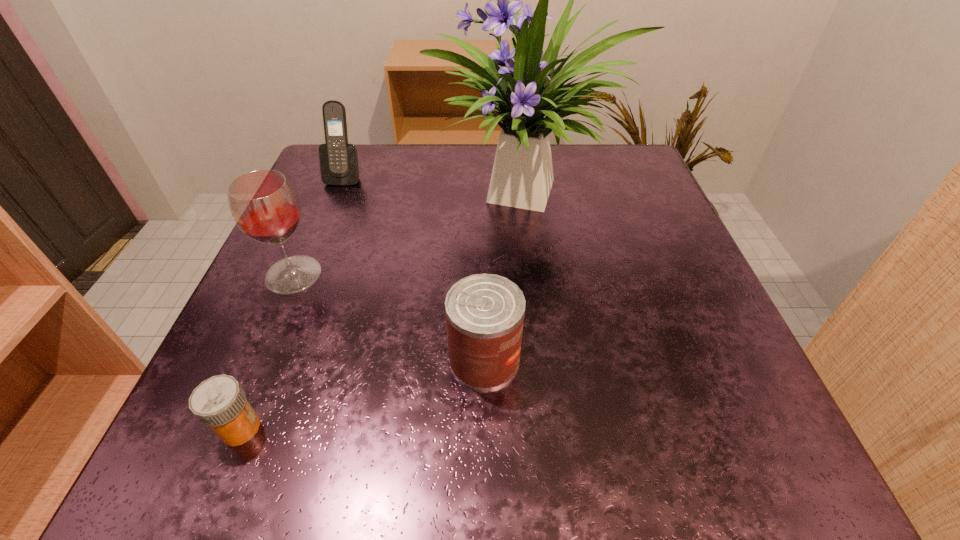
I want to click on blank space that satisfies the following two spatial constraints: 1. on the back side of the tallest object; 2. on the left side of the second nearest object, so click(483, 191).

The width and height of the screenshot is (960, 540). Find the location of `blank area in the image that satisfies the following two spatial constraints: 1. on the front-facing side of the third shortest object; 2. on the right side of the second shortest object`. blank area in the image that satisfies the following two spatial constraints: 1. on the front-facing side of the third shortest object; 2. on the right side of the second shortest object is located at coordinates (272, 360).

Locate an element on the screen. vacant space that satisfies the following two spatial constraints: 1. on the front-facing side of the cellular telephone; 2. on the left side of the tallest object is located at coordinates (339, 191).